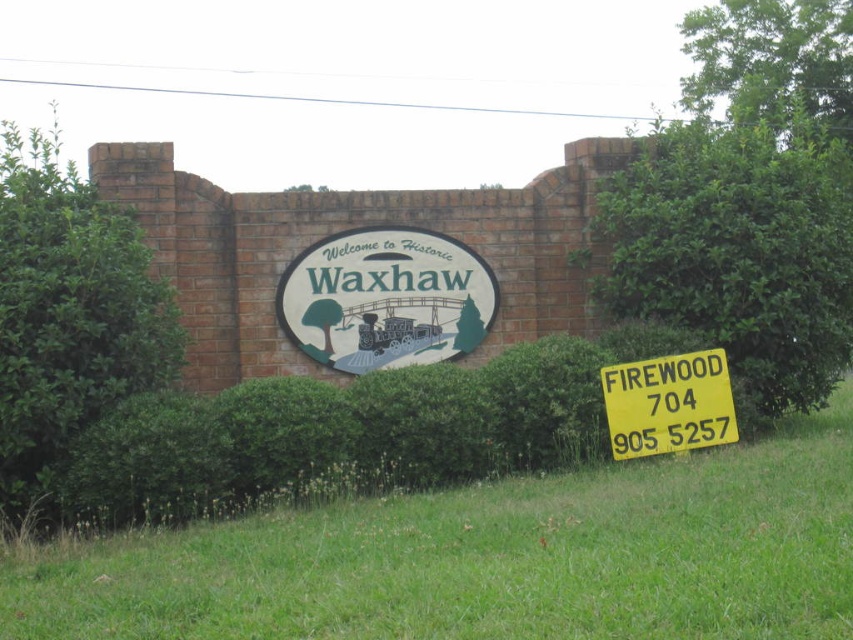
Question: Which point is closer to the camera?

Choices:
 (A) yellow plastic sign at lower right
 (B) green leafy bush at right

Answer: (A)

Question: Which point appears farthest from the camera in this image?

Choices:
 (A) (126, 323)
 (B) (706, 388)
 (C) (607, 269)

Answer: (C)

Question: Can you confirm if white painted wood sign at center is positioned below yellow plastic sign at lower right?

Choices:
 (A) no
 (B) yes

Answer: (A)

Question: Is green leafy bush at left thinner than white painted wood sign at center?

Choices:
 (A) yes
 (B) no

Answer: (A)

Question: Does green leafy bush at left appear over white painted wood sign at center?

Choices:
 (A) no
 (B) yes

Answer: (B)

Question: Among these points, which one is farthest from the camera?

Choices:
 (A) (105, 360)
 (B) (316, 595)
 (C) (706, 316)

Answer: (C)